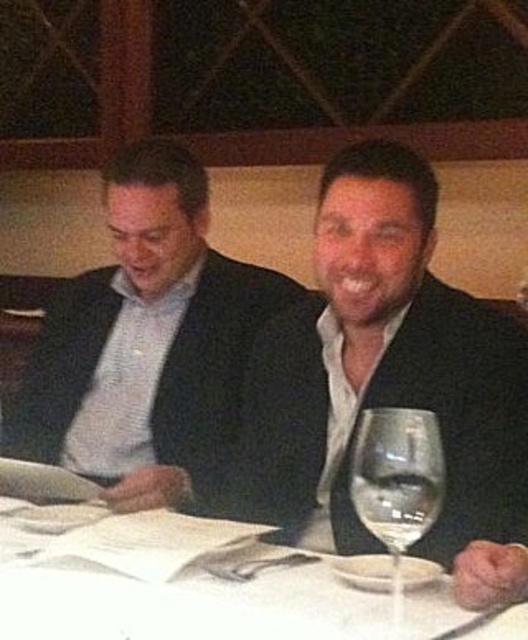
You are a photographer trying to capture both the black matte suit at center and the matte black suit at center in the same frame. Since they are very similar in appearance, you need to distinguish them based on their sizes. Which one should you focus on first to ensure both are clearly visible in your photo?

The black matte suit at center is larger in size than the matte black suit at center, so you should focus on the black matte suit at center first to ensure it is clearly visible, then adjust the focus to include the smaller matte black suit at center in the frame.

You are a server in a restaurant and need to place a new drink order for the customer seated at the table with the black matte suit at center and the clear glass wine glass at center. Which item should you prioritize moving to ensure there is enough space for the new drink?

The black matte suit at center is above the clear glass wine glass at center, so you should prioritize moving the clear glass wine glass at center to make space for the new drink since it is below the suit and likely on the table.

You are a waiter in a restaurant and need to place a new menu on the table. The table has a white paper at center and a clear glass wine glass at center. Where should you place the menu so it doesn not interfere with the existing items?

The white paper at center is located below the clear glass wine glass at center. To avoid interference, place the menu next to the clear glass wine glass at center, ensuring it does not cover the white paper at center.